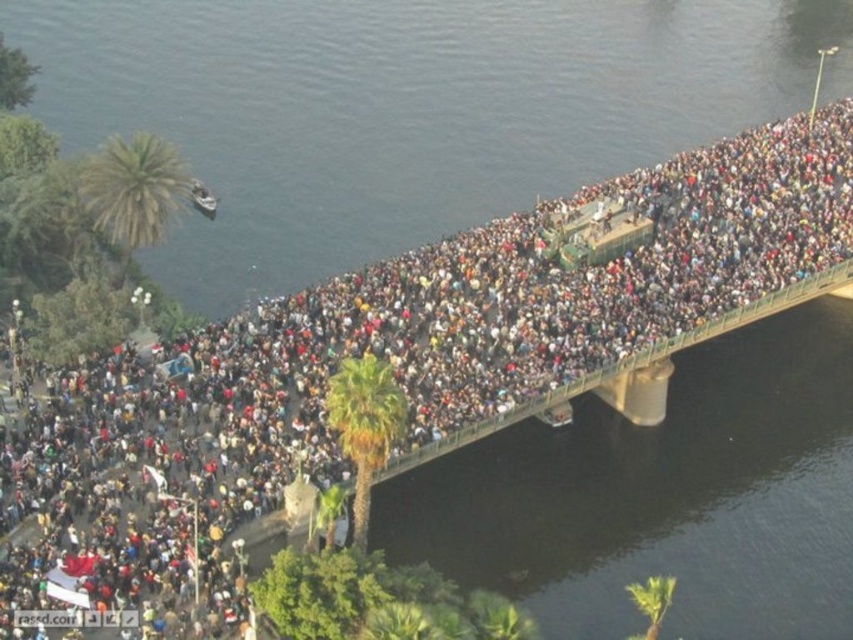
Question: Is green leafy palm tree at upper left below metallic silver boat at upper left?

Choices:
 (A) no
 (B) yes

Answer: (A)

Question: In this image, where is green leafy palm tree at center located relative to metallic silver boat at upper left?

Choices:
 (A) left
 (B) right

Answer: (B)

Question: From the image, what is the correct spatial relationship of dark blue water at center in relation to green leafy palm tree at lower center?

Choices:
 (A) right
 (B) left

Answer: (B)

Question: Estimate the real-world distances between objects in this image. Which object is closer to the green leafy palm tree at lower center?

Choices:
 (A) dark blue water at center
 (B) green leafy palm tree at upper left
 (C) metallic silver boat at upper left
 (D) green leafy palm tree at center

Answer: (D)

Question: Which of the following is the closest to the observer?

Choices:
 (A) green leafy palm tree at upper left
 (B) metallic silver boat at upper left
 (C) green leafy palm tree at lower center
 (D) dark blue water at center

Answer: (C)

Question: Which point is farther to the camera?

Choices:
 (A) (341, 403)
 (B) (189, 186)
 (C) (659, 632)

Answer: (B)